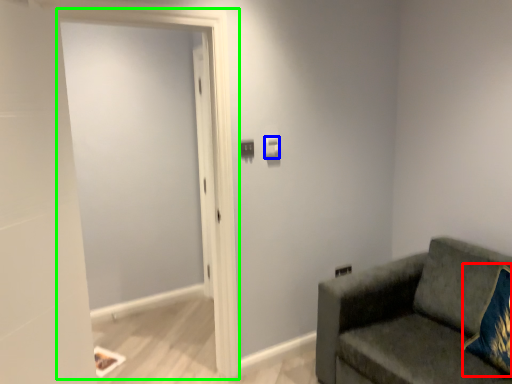
Question: Considering the real-world distances, which object is farthest from throw pillow (highlighted by a red box)? light switch (highlighted by a blue box) or screen door (highlighted by a green box)?

Choices:
 (A) light switch
 (B) screen door

Answer: (B)